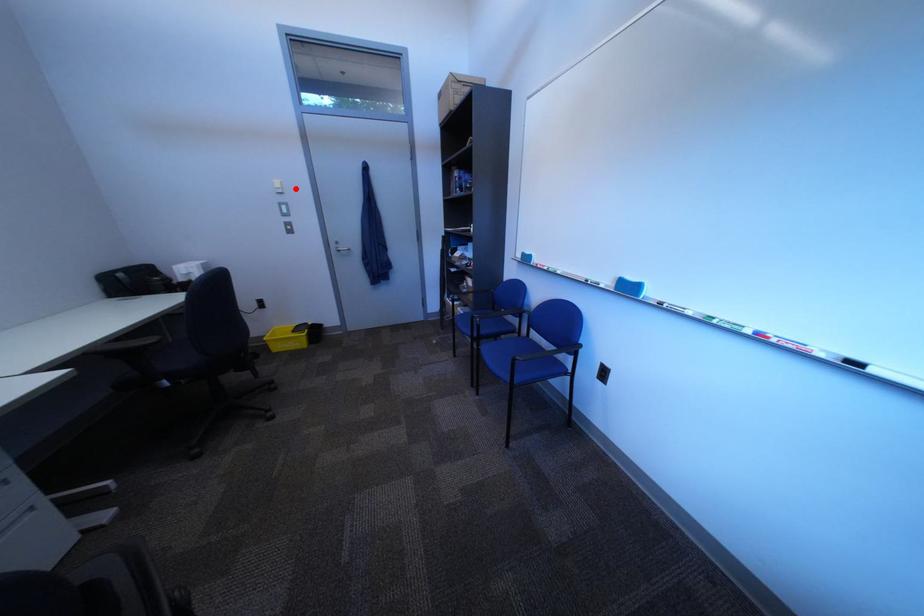
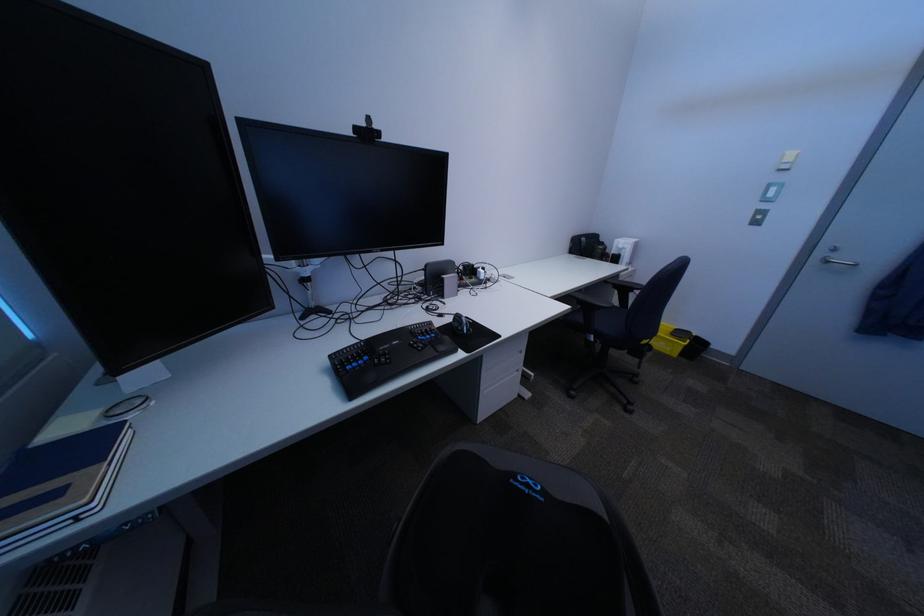
Question: I am providing you with two images of the same scene from different viewpoints. A red point is marked on the first image. At the location where the point appears in image 1, is it still visible in image 2?

Choices:
 (A) Yes
 (B) No

Answer: (A)